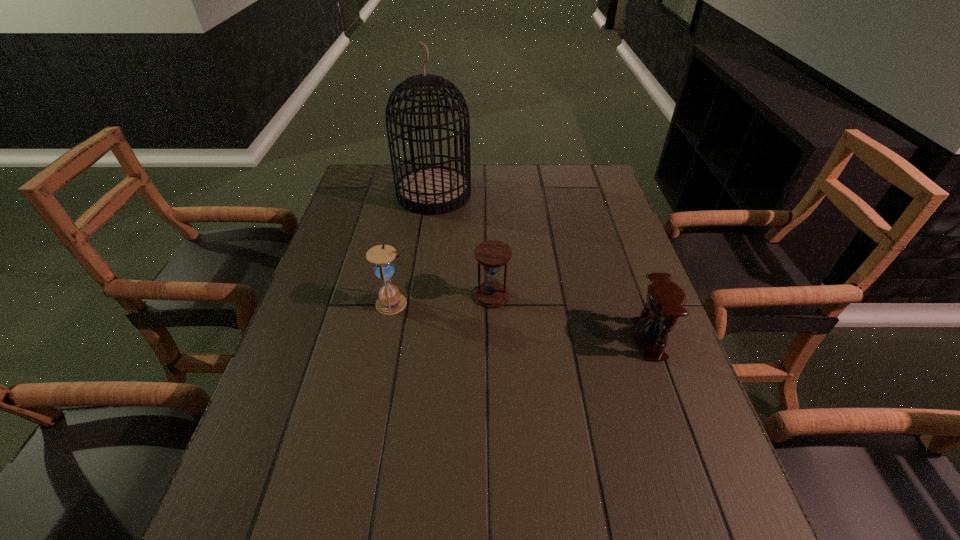
Where is `vacant position in the image that satisfies the following two spatial constraints: 1. on the back side of the third shortest object; 2. on the right side of the tallest object`? The height and width of the screenshot is (540, 960). vacant position in the image that satisfies the following two spatial constraints: 1. on the back side of the third shortest object; 2. on the right side of the tallest object is located at coordinates coord(416,194).

Where is `vacant area that satisfies the following two spatial constraints: 1. on the front side of the second hourglass from left to right; 2. on the right side of the tallest object`? The width and height of the screenshot is (960, 540). vacant area that satisfies the following two spatial constraints: 1. on the front side of the second hourglass from left to right; 2. on the right side of the tallest object is located at coordinates (420, 296).